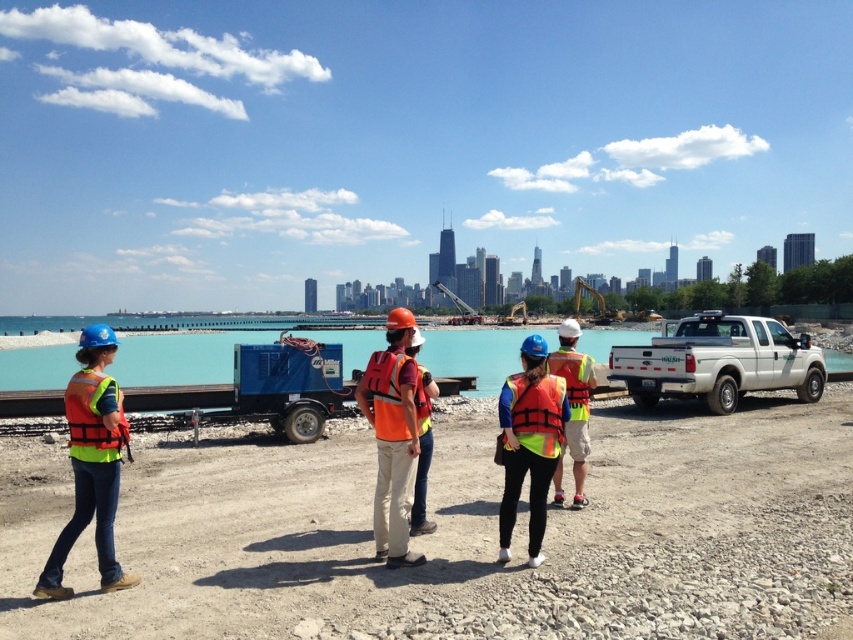
Question: Which point is closer to the camera?

Choices:
 (A) (402, 381)
 (B) (769, 321)

Answer: (A)

Question: Can you confirm if neon yellow safety vest at center is positioned below orange reflective vest at center?

Choices:
 (A) no
 (B) yes

Answer: (B)

Question: Is orange reflective vest at center to the right of reflective orange life vest at center from the viewer's perspective?

Choices:
 (A) yes
 (B) no

Answer: (B)

Question: Is neon yellow safety vest at center thinner than reflective yellow safety vest at center?

Choices:
 (A) no
 (B) yes

Answer: (A)

Question: Which of the following is the farthest from the observer?

Choices:
 (A) (538, 474)
 (B) (96, 397)

Answer: (A)

Question: Among these points, which one is farthest from the camera?

Choices:
 (A) (392, 388)
 (B) (61, 541)

Answer: (A)